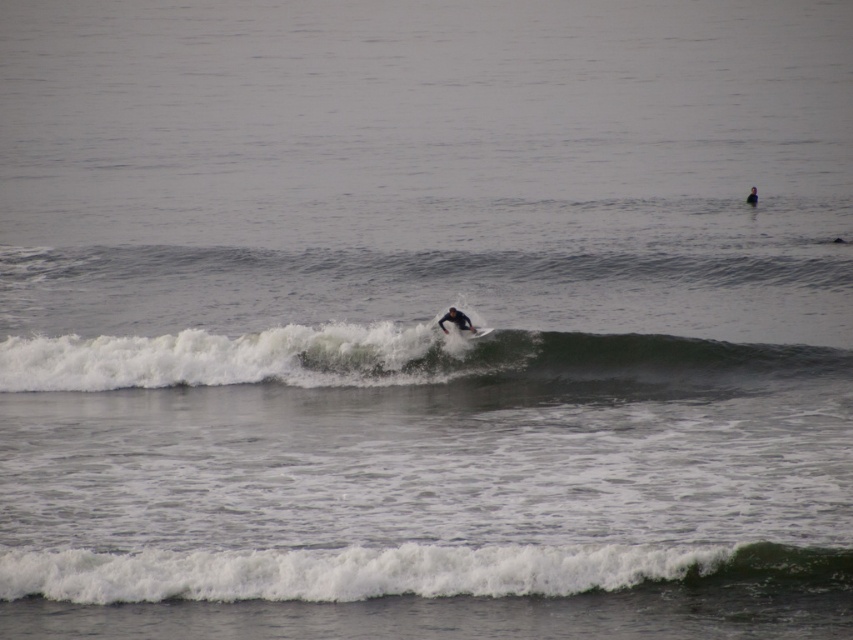
Who is positioned more to the left, white foam wave at center or black matte wetsuit at center?

white foam wave at center is more to the left.

Which is in front, point (733, 378) or point (753, 204)?

Point (733, 378)

Locate an element on the screen. white foam wave at center is located at coordinates (397, 358).

At what (x,y) coordinates should I click in order to perform the action: click on white foamy wave at lower center. Please return your answer as a coordinate pair (x, y). Looking at the image, I should click on (404, 572).

Where is `white foamy wave at lower center`? The width and height of the screenshot is (853, 640). white foamy wave at lower center is located at coordinates (404, 572).

Does white foamy wave at lower center have a larger size compared to white foam surfboard at center?

Yes.

Can you confirm if white foamy wave at lower center is smaller than white foam surfboard at center?

Actually, white foamy wave at lower center might be larger than white foam surfboard at center.

Find the location of a particular element. The height and width of the screenshot is (640, 853). white foamy wave at lower center is located at coordinates (404, 572).

Identify the location of white foamy wave at lower center. (404, 572).